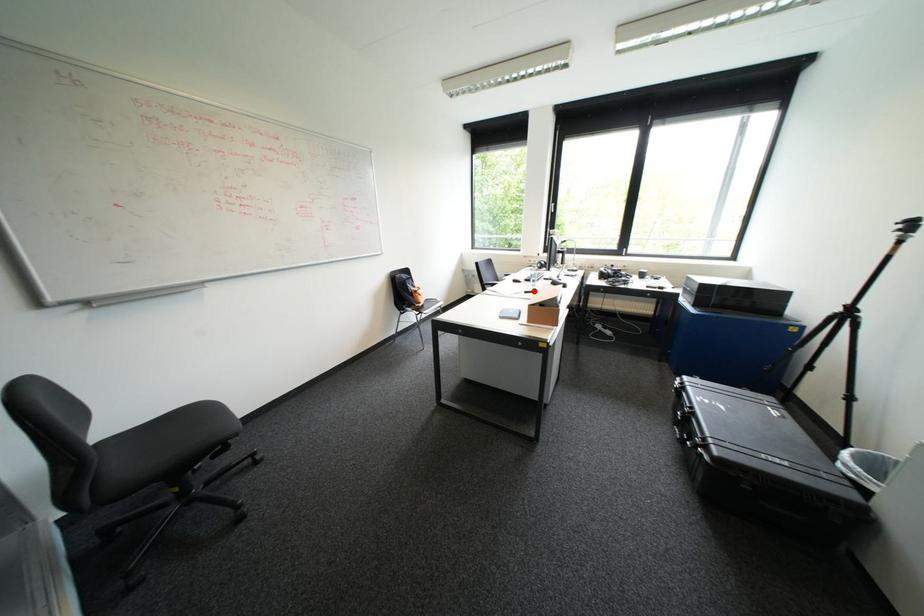
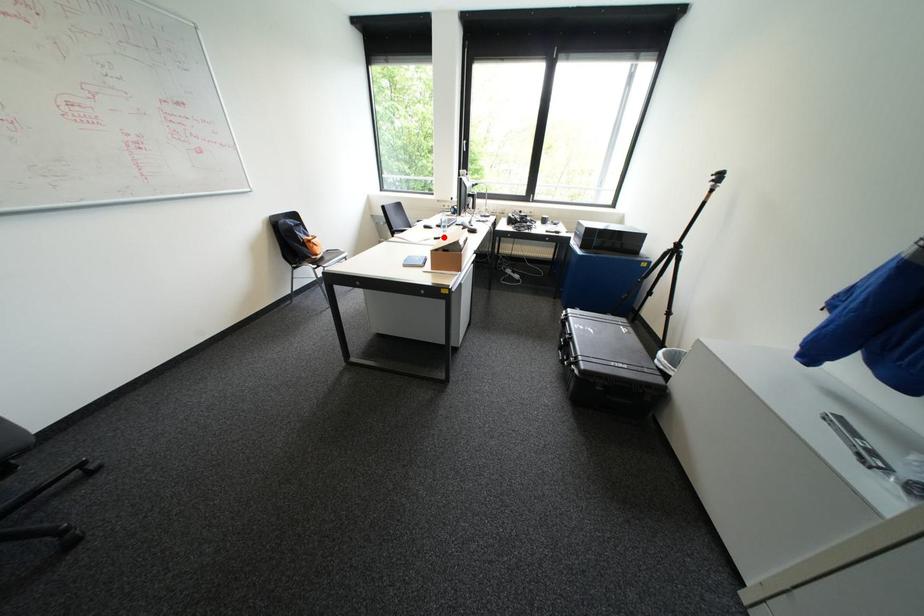
I am providing you with two images of the same scene from different viewpoints. A red point is marked on the first image and another point is marked on the second image. Is the red point in image1 aligned with the point shown in image2?

Yes